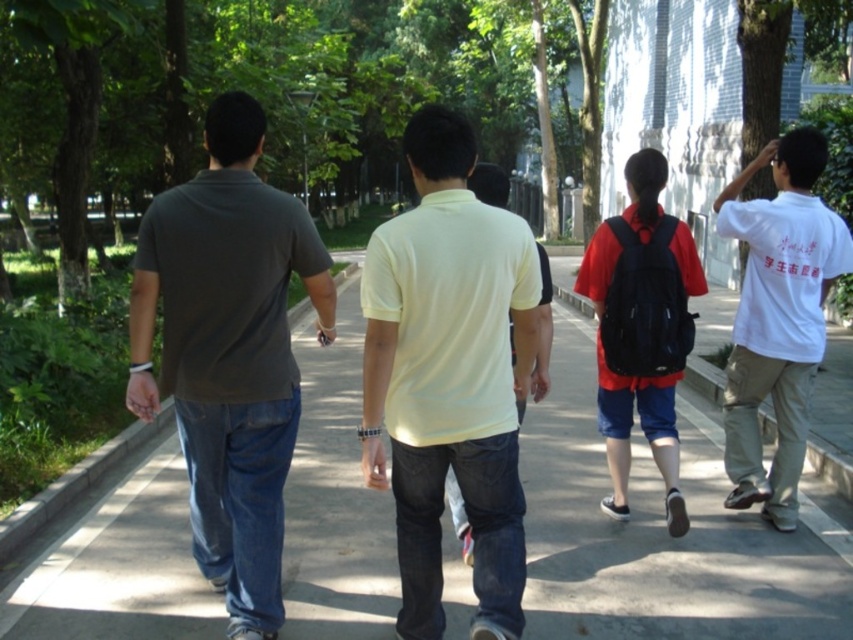
What are the coordinates of the yellow cotton shirt at center?

The yellow cotton shirt at center is located at coordinates point [450,376].

Based on the photo, you are standing at the origin point of the coordinate system. You see a point at coordinate (229, 353). What object is located at that point?

The point at coordinate (229, 353) corresponds to the dark gray cotton t shirt at left.